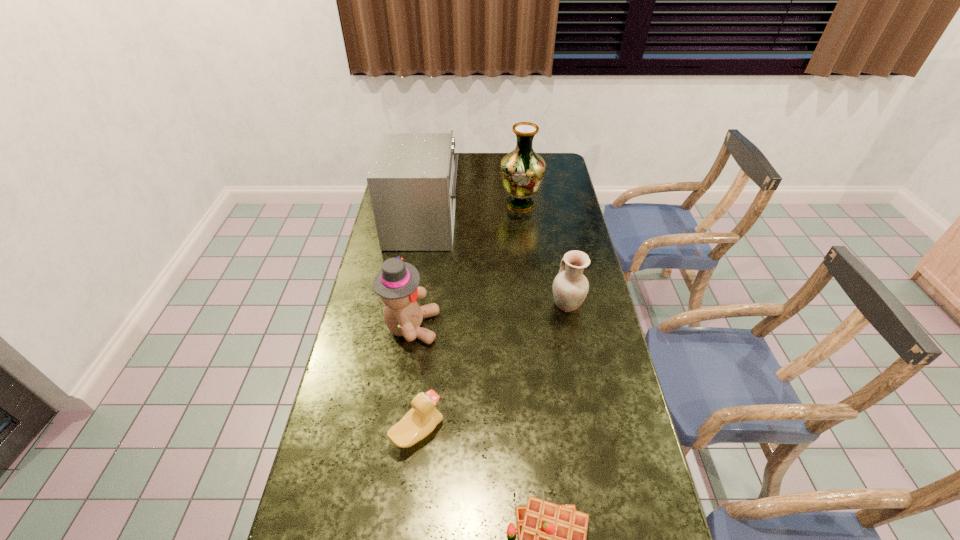
What are the coordinates of `vase` in the screenshot? It's located at (522, 171).

Where is `toaster oven`? This screenshot has width=960, height=540. toaster oven is located at coordinates [x=412, y=180].

Locate an element on the screen. the fourth shortest object is located at coordinates (397, 282).

The height and width of the screenshot is (540, 960). Identify the location of pottery. (570, 287).

I want to click on duck, so pos(423,417).

The width and height of the screenshot is (960, 540). What are the coordinates of `the second nearest object` in the screenshot? It's located at (423, 417).

Where is `vacant space located 0.290m on the back of the vase`? vacant space located 0.290m on the back of the vase is located at coordinates (516, 159).

The height and width of the screenshot is (540, 960). Find the location of `free region located on the front panel of the toaster oven`. free region located on the front panel of the toaster oven is located at coordinates (499, 225).

Find the location of a particular element. The width and height of the screenshot is (960, 540). vacant position located 0.180m on the front-facing side of the rag_doll is located at coordinates (496, 327).

What are the coordinates of `free location located 0.260m on the left of the pottery` in the screenshot? It's located at (471, 304).